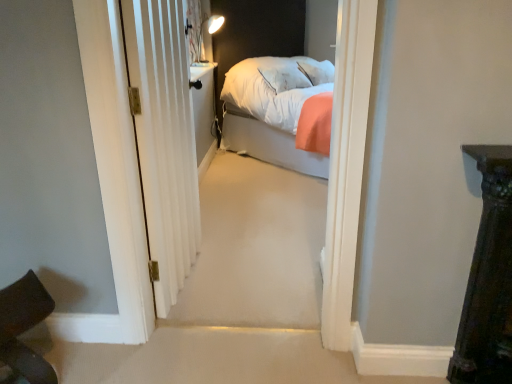
Question: Is white textured door at center looking in the opposite direction of dark brown leather chair at lower left?

Choices:
 (A) yes
 (B) no

Answer: (B)

Question: Is white textured door at center to the right of dark brown leather chair at lower left from the viewer's perspective?

Choices:
 (A) no
 (B) yes

Answer: (B)

Question: Can you confirm if white textured door at center is taller than dark brown leather chair at lower left?

Choices:
 (A) no
 (B) yes

Answer: (B)

Question: Is white textured door at center positioned far away from dark brown leather chair at lower left?

Choices:
 (A) no
 (B) yes

Answer: (A)

Question: Can you confirm if white textured door at center is smaller than dark brown leather chair at lower left?

Choices:
 (A) yes
 (B) no

Answer: (B)

Question: Does white textured door at center have a greater width compared to dark brown leather chair at lower left?

Choices:
 (A) no
 (B) yes

Answer: (A)

Question: Is the surface of dark brown leather chair at lower left in direct contact with white textured door at center?

Choices:
 (A) no
 (B) yes

Answer: (A)

Question: Can you confirm if dark brown leather chair at lower left is thinner than white textured door at center?

Choices:
 (A) yes
 (B) no

Answer: (B)

Question: Can you confirm if dark brown leather chair at lower left is smaller than white textured door at center?

Choices:
 (A) no
 (B) yes

Answer: (B)

Question: From the image's perspective, is dark brown leather chair at lower left located above white textured door at center?

Choices:
 (A) no
 (B) yes

Answer: (A)

Question: Considering the relative sizes of dark brown leather chair at lower left and white textured door at center in the image provided, is dark brown leather chair at lower left shorter than white textured door at center?

Choices:
 (A) yes
 (B) no

Answer: (A)

Question: From a real-world perspective, is dark brown leather chair at lower left positioned under white textured door at center based on gravity?

Choices:
 (A) yes
 (B) no

Answer: (A)

Question: Does point (27, 299) appear closer or farther from the camera than point (187, 258)?

Choices:
 (A) farther
 (B) closer

Answer: (B)